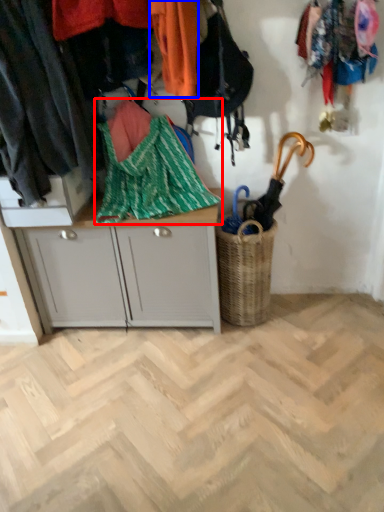
Question: Which object is further to the camera taking this photo, blanket (highlighted by a red box) or clothing (highlighted by a blue box)?

Choices:
 (A) blanket
 (B) clothing

Answer: (A)